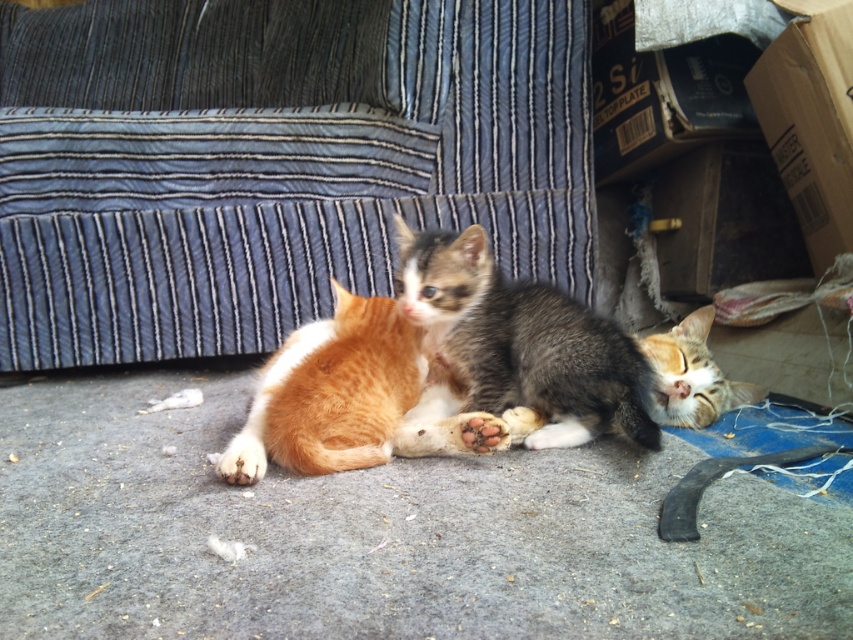
Is gray-furred kitten at center shorter than orange fur cat at center?

No, gray-furred kitten at center is not shorter than orange fur cat at center.

Can you confirm if gray-furred kitten at center is positioned below orange fur cat at center?

No, gray-furred kitten at center is not below orange fur cat at center.

Is point (538, 285) farther from camera compared to point (418, 337)?

Yes, point (538, 285) is farther from viewer.

I want to click on gray-furred kitten at center, so click(x=521, y=342).

Does blue striped fabric couch at upper center have a greater width compared to orange fur cat at center?

Correct, the width of blue striped fabric couch at upper center exceeds that of orange fur cat at center.

Looking at this image, which of these two, blue striped fabric couch at upper center or orange fur cat at center, stands shorter?

Standing shorter between the two is orange fur cat at center.

Which is behind, point (109, 161) or point (383, 420)?

The point (109, 161) is behind.

You are a GUI agent. You are given a task and a screenshot of the screen. Output one action in this format:
    pyautogui.click(x=<x>, y=<y>)
    Task: Click on the blue striped fabric couch at upper center
    
    Given the screenshot: What is the action you would take?
    pyautogui.click(x=271, y=161)

From the picture: Is blue striped fabric couch at upper center above tabby fur cat at lower right?

Indeed, blue striped fabric couch at upper center is positioned over tabby fur cat at lower right.

Who is lower down, blue striped fabric couch at upper center or tabby fur cat at lower right?

tabby fur cat at lower right

Measure the distance between point (277, 45) and camera.

Point (277, 45) and camera are 7.90 feet apart.

Locate an element on the screen. The image size is (853, 640). blue striped fabric couch at upper center is located at coordinates (271, 161).